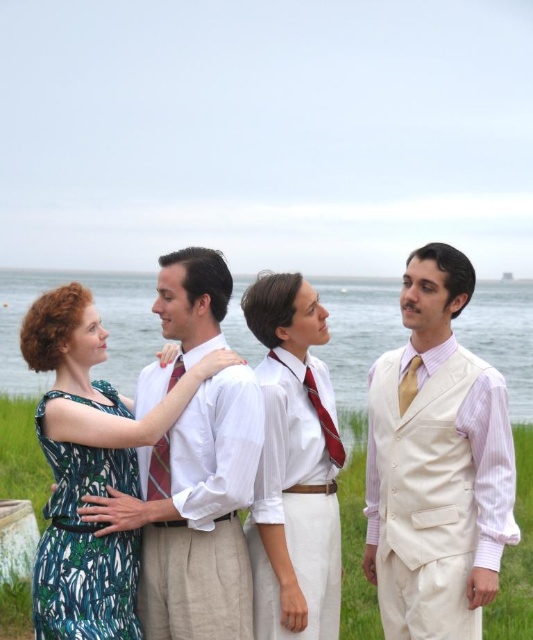
Does point (408, 637) come behind point (112, 483)?

Yes.

Between light beige fabric vest at right and green floral fabric dress at left, which one appears on the right side from the viewer's perspective?

From the viewer's perspective, light beige fabric vest at right appears more on the right side.

Between point (439, 356) and point (39, 616), which one is positioned behind?

The point (439, 356) is behind.

The height and width of the screenshot is (640, 533). In order to click on light beige fabric vest at right in this screenshot , I will do `click(439, 465)`.

Based on the photo, can you confirm if clear blue water at center is positioned below red silk tie at center?

No.

Between clear blue water at center and red silk tie at center, which one appears on the right side from the viewer's perspective?

From the viewer's perspective, clear blue water at center appears more on the right side.

Locate an element on the screen. The image size is (533, 640). clear blue water at center is located at coordinates (101, 317).

Can you confirm if green floral dress at left is positioned below red silk tie at center?

Actually, green floral dress at left is above red silk tie at center.

Is green floral dress at left behind red silk tie at center?

No, green floral dress at left is in front of red silk tie at center.

Who is more distant from viewer, (x=72, y=376) or (x=156, y=477)?

The point (x=156, y=477) is behind.

This screenshot has height=640, width=533. In order to click on green floral dress at left in this screenshot , I will do `click(90, 468)`.